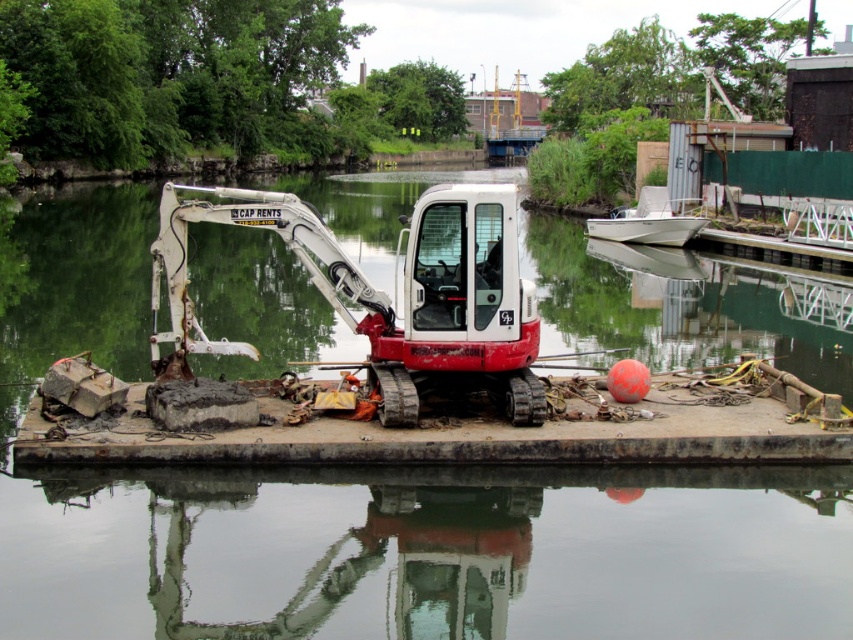
You are standing on the floating platform with the CAP RENTS excavator and want to pick up an object located at point [718,404]. There is another object at point [666,209]. Which object is closer to you?

The object at point [718,404] is closer to you than the one at point [666,209].

You are a photographer standing on the rusty concrete dock at center and want to take a photo of the white matte boat at upper right. Will the boat be fully visible in your photo without any obstructions from the dock?

The rusty concrete dock at center is in front of the white matte boat at upper right, so the boat may be partially obstructed by the dock in your photo.